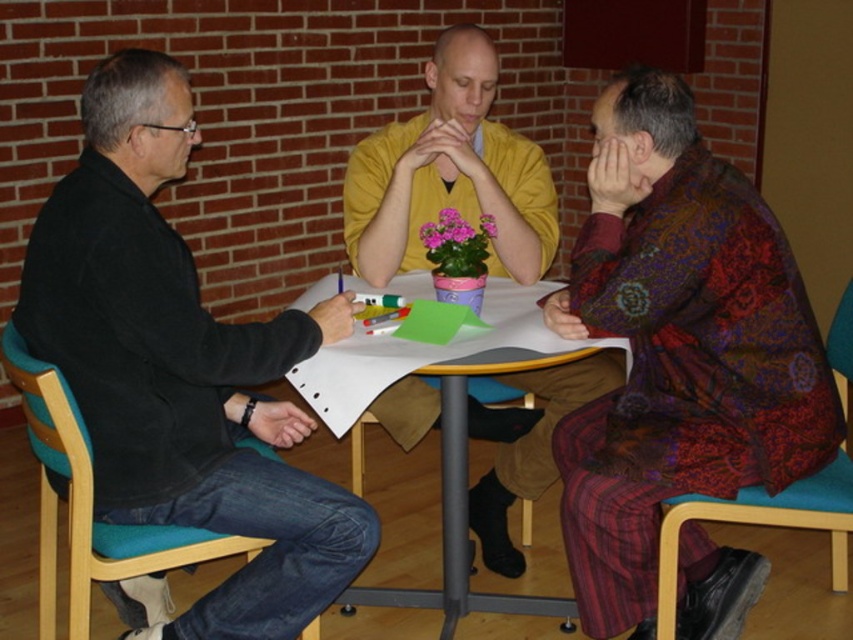
Question: Is yellow matte shirt at center above teal wood chair at lower left?

Choices:
 (A) yes
 (B) no

Answer: (A)

Question: Which point appears closest to the camera in this image?

Choices:
 (A) (178, 440)
 (B) (79, 536)

Answer: (B)

Question: Which of the following is the closest to the observer?

Choices:
 (A) (773, 520)
 (B) (105, 557)

Answer: (B)

Question: Is yellow matte shirt at center positioned at the back of teal wood chair at lower left?

Choices:
 (A) yes
 (B) no

Answer: (A)

Question: Which point appears closest to the camera in this image?

Choices:
 (A) (445, 145)
 (B) (44, 604)

Answer: (B)

Question: Can you confirm if black matte jacket at left is positioned below teal wood chair at lower left?

Choices:
 (A) yes
 (B) no

Answer: (B)